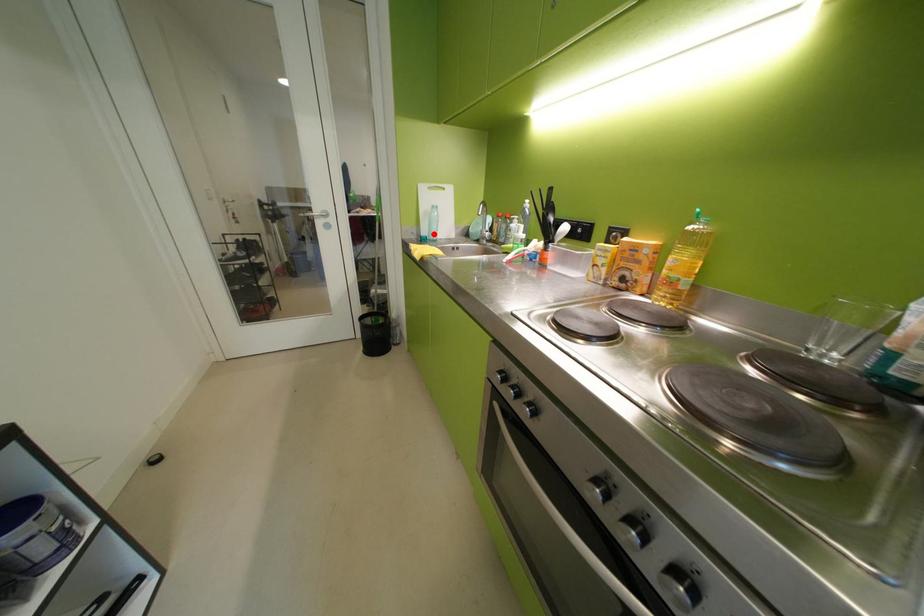
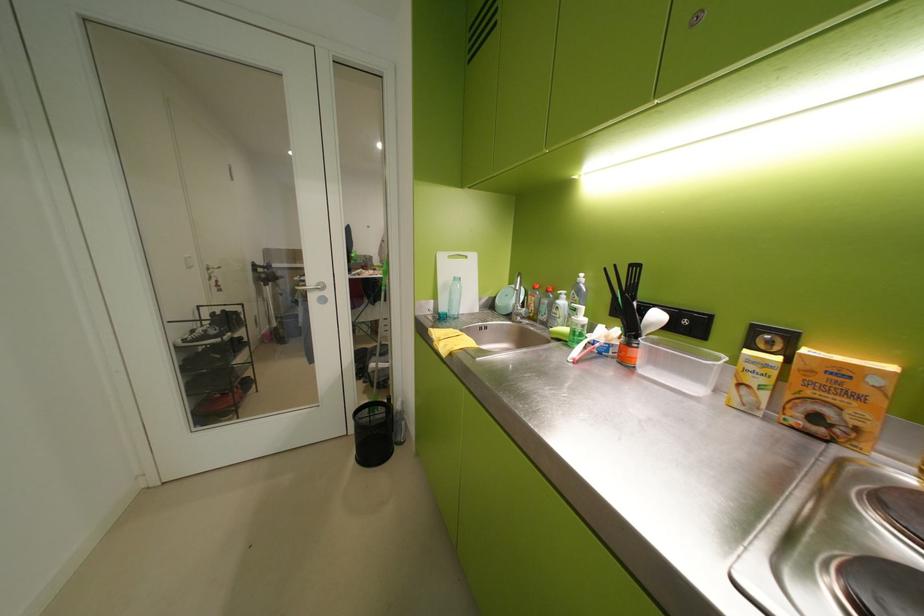
In the second image, find the point that corresponds to the highlighted location in the first image.

(453, 310)